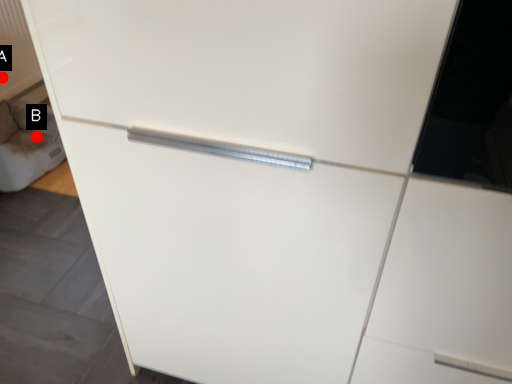
Question: Two points are circled on the image, labeled by A and B beside each circle. Which of the following is the closest to the observer?

Choices:
 (A) A is closer
 (B) B is closer

Answer: (B)